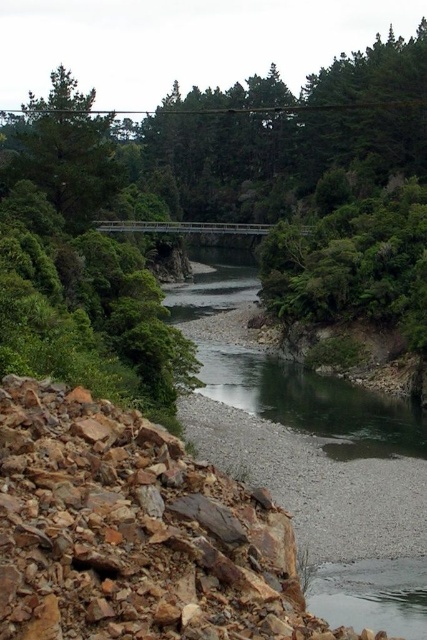
Does green leafy tree at center have a larger size compared to green matte tree at upper left?

No, green leafy tree at center is not bigger than green matte tree at upper left.

Consider the image. Who is taller, green leafy tree at center or green matte tree at upper left?

Standing taller between the two is green matte tree at upper left.

Locate an element on the screen. The height and width of the screenshot is (640, 427). green leafy tree at center is located at coordinates (353, 264).

Which of these two, gray gravel stream at center or green leafy tree at center, stands shorter?

green leafy tree at center

Is gray gravel stream at center thinner than green leafy tree at center?

No.

Consider the image. Measure the distance between point [362,422] and camera.

Point [362,422] is 52.76 meters from camera.

Image resolution: width=427 pixels, height=640 pixels. I want to click on gray gravel stream at center, so click(x=318, y=412).

Is gray gravel stream at center taller than green matte tree at upper left?

No, gray gravel stream at center is not taller than green matte tree at upper left.

Does gray gravel stream at center appear under green matte tree at upper left?

Yes, gray gravel stream at center is below green matte tree at upper left.

Consider the image. Who is more forward, (415, 598) or (70, 141)?

Point (415, 598) is more forward.

The image size is (427, 640). What are the coordinates of `gray gravel stream at center` in the screenshot? It's located at (318, 412).